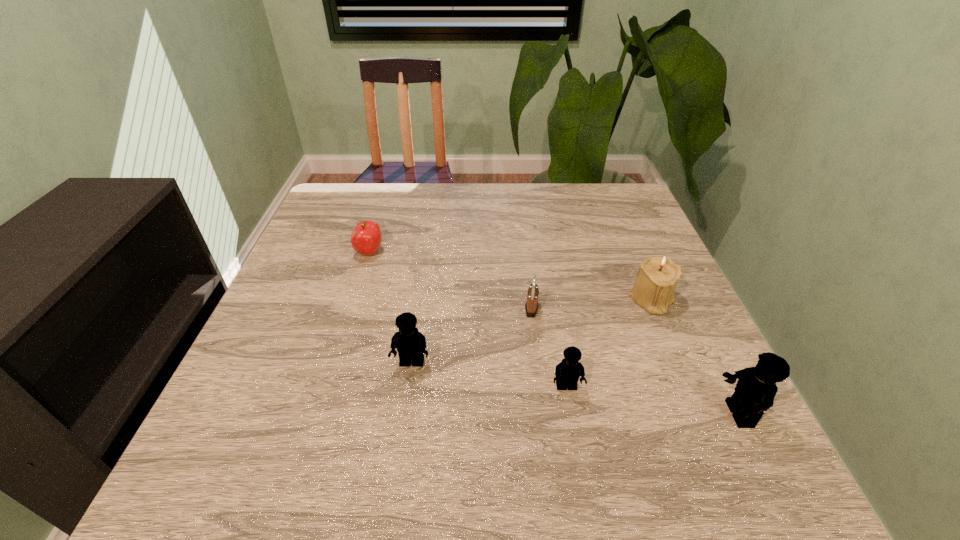
The height and width of the screenshot is (540, 960). I want to click on the leftmost Lego, so click(410, 343).

Where is `the farthest Lego`? the farthest Lego is located at coordinates (410, 343).

The width and height of the screenshot is (960, 540). I want to click on the third object from right to left, so click(567, 372).

Locate an element on the screen. The height and width of the screenshot is (540, 960). the shortest Lego is located at coordinates (567, 372).

Locate an element on the screen. Image resolution: width=960 pixels, height=540 pixels. the tallest object is located at coordinates (755, 390).

I want to click on the tallest Lego, so click(755, 390).

You are a GUI agent. You are given a task and a screenshot of the screen. Output one action in this format:
    pyautogui.click(x=<x>, y=<y>)
    Task: Click on the apple
    This screenshot has width=960, height=540.
    Given the screenshot: What is the action you would take?
    pyautogui.click(x=366, y=238)

The height and width of the screenshot is (540, 960). I want to click on the leftmost object, so click(x=366, y=238).

In order to click on candle_holder in this screenshot , I will do `click(657, 277)`.

Locate an element on the screen. The height and width of the screenshot is (540, 960). padlock is located at coordinates (531, 307).